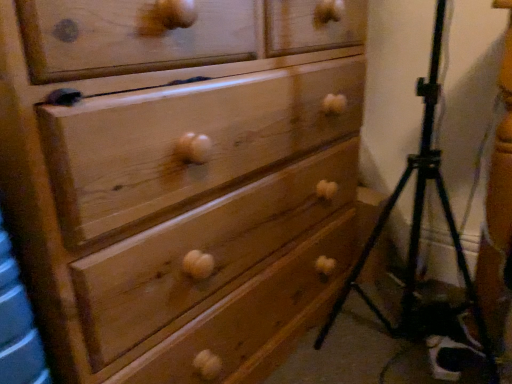
Question: From a real-world perspective, relative to black metal tripod at lower right, is wooden chest of drawers at center vertically above or below?

Choices:
 (A) below
 (B) above

Answer: (B)

Question: In terms of height, does wooden chest of drawers at center look taller or shorter compared to black metal tripod at lower right?

Choices:
 (A) short
 (B) tall

Answer: (B)

Question: Is wooden chest of drawers at center in front of or behind black metal tripod at lower right in the image?

Choices:
 (A) front
 (B) behind

Answer: (A)

Question: From a real-world perspective, is black metal tripod at lower right positioned above or below wooden chest of drawers at center?

Choices:
 (A) below
 (B) above

Answer: (A)

Question: Is black metal tripod at lower right to the left or to the right of wooden chest of drawers at center in the image?

Choices:
 (A) left
 (B) right

Answer: (B)

Question: In terms of size, does black metal tripod at lower right appear bigger or smaller than wooden chest of drawers at center?

Choices:
 (A) big
 (B) small

Answer: (B)

Question: Is black metal tripod at lower right spatially inside wooden chest of drawers at center, or outside of it?

Choices:
 (A) outside
 (B) inside

Answer: (A)